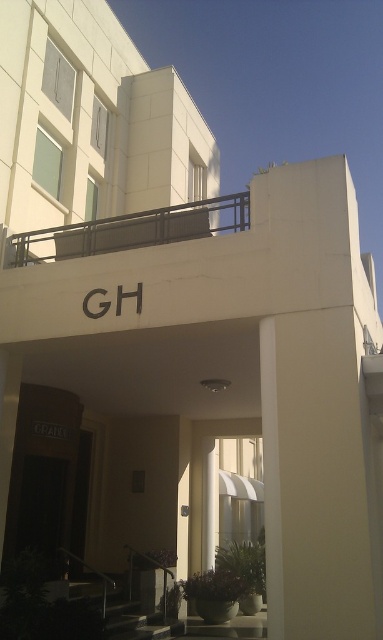
Question: Can you confirm if metallic gray balustrade at upper center is positioned to the right of metallic rail at lower center?

Choices:
 (A) yes
 (B) no

Answer: (B)

Question: Which object appears farthest from the camera in this image?

Choices:
 (A) metallic rail at lower center
 (B) metallic gray balustrade at upper center

Answer: (A)

Question: Does metallic gray balustrade at upper center lie behind metallic rail at lower center?

Choices:
 (A) no
 (B) yes

Answer: (A)

Question: Is metallic gray balustrade at upper center to the right of metallic rail at lower center from the viewer's perspective?

Choices:
 (A) no
 (B) yes

Answer: (A)

Question: Which point is closer to the camera?

Choices:
 (A) (189, 204)
 (B) (85, 563)

Answer: (A)

Question: Among these points, which one is nearest to the camera?

Choices:
 (A) (173, 208)
 (B) (81, 563)

Answer: (A)